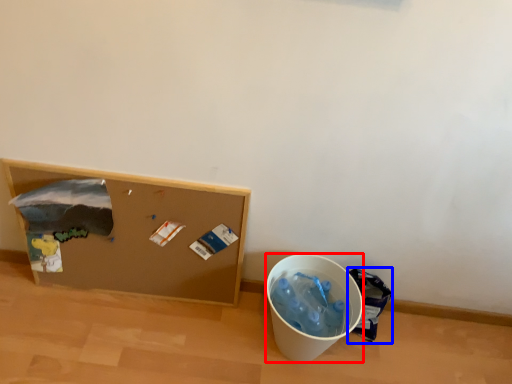
Question: Which point is closer to the camera, recycling bin (highlighted by a red box) or garbage (highlighted by a blue box)?

Choices:
 (A) recycling bin
 (B) garbage

Answer: (A)